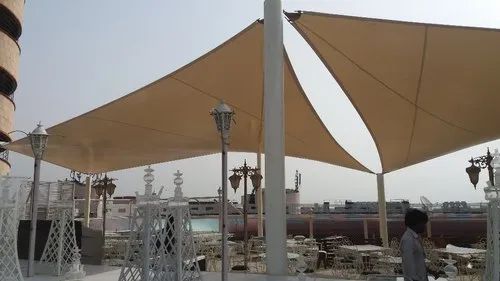
The height and width of the screenshot is (281, 500). I want to click on tables, so click(364, 249), click(383, 256), click(455, 251), click(294, 254), click(294, 244), click(233, 243), click(208, 241).